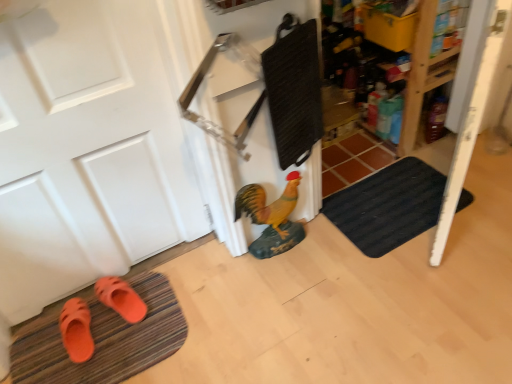
I want to click on free spot above black textured bath mat at lower right, marked as the 2th bath mat in a bottom-to-top arrangement (from a real-world perspective), so pos(377,206).